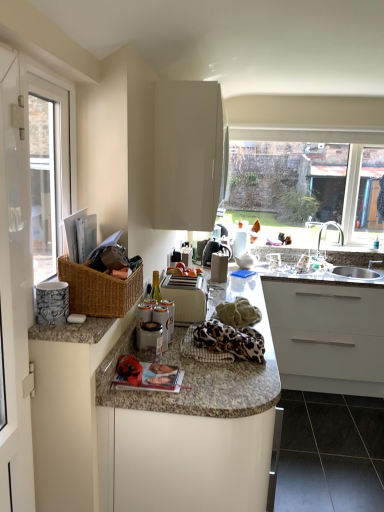
Question: Does silver metallic faucet at right have a greater height compared to white glossy screen door at left?

Choices:
 (A) yes
 (B) no

Answer: (B)

Question: From the image's perspective, does silver metallic faucet at right appear lower than white glossy screen door at left?

Choices:
 (A) yes
 (B) no

Answer: (B)

Question: From the image's perspective, is silver metallic faucet at right located above white glossy screen door at left?

Choices:
 (A) yes
 (B) no

Answer: (A)

Question: Is silver metallic faucet at right closer to the viewer compared to white glossy screen door at left?

Choices:
 (A) yes
 (B) no

Answer: (B)

Question: Does silver metallic faucet at right have a larger size compared to white glossy screen door at left?

Choices:
 (A) no
 (B) yes

Answer: (A)

Question: Can you confirm if silver metallic faucet at right is thinner than white glossy screen door at left?

Choices:
 (A) yes
 (B) no

Answer: (B)

Question: Does white glossy screen door at left appear on the right side of black glossy tile at lower right?

Choices:
 (A) yes
 (B) no

Answer: (B)

Question: From the image's perspective, would you say white glossy screen door at left is positioned over black glossy tile at lower right?

Choices:
 (A) yes
 (B) no

Answer: (A)

Question: Are white glossy screen door at left and black glossy tile at lower right far apart?

Choices:
 (A) yes
 (B) no

Answer: (A)

Question: From a real-world perspective, is white glossy screen door at left on black glossy tile at lower right?

Choices:
 (A) yes
 (B) no

Answer: (A)

Question: Is black glossy tile at lower right inside white glossy screen door at left?

Choices:
 (A) yes
 (B) no

Answer: (B)

Question: Is white glossy screen door at left in contact with black glossy tile at lower right?

Choices:
 (A) yes
 (B) no

Answer: (B)

Question: From a real-world perspective, does porcelain blue and white mug at left, the first appliance viewed from the front, stand above black glossy tile at lower right?

Choices:
 (A) yes
 (B) no

Answer: (A)